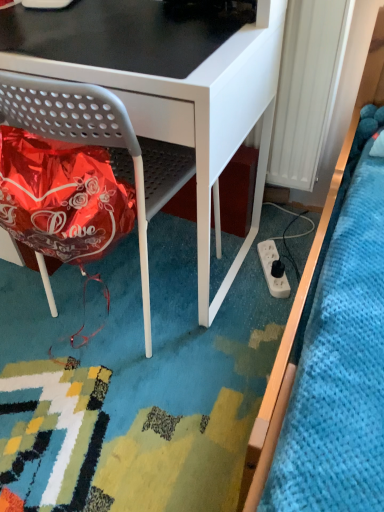
Question: Is matte gray chair at lower left bigger or smaller than white plastic radiator at right?

Choices:
 (A) small
 (B) big

Answer: (B)

Question: From a real-world perspective, is matte gray chair at lower left positioned above or below white plastic radiator at right?

Choices:
 (A) above
 (B) below

Answer: (B)

Question: Which object is positioned closest to the white plastic power plugs and sockets at lower right?

Choices:
 (A) matte gray chair at lower left
 (B) white plastic radiator at right

Answer: (B)

Question: Which is farther from the white plastic power plugs and sockets at lower right?

Choices:
 (A) white plastic radiator at right
 (B) matte gray chair at lower left

Answer: (B)